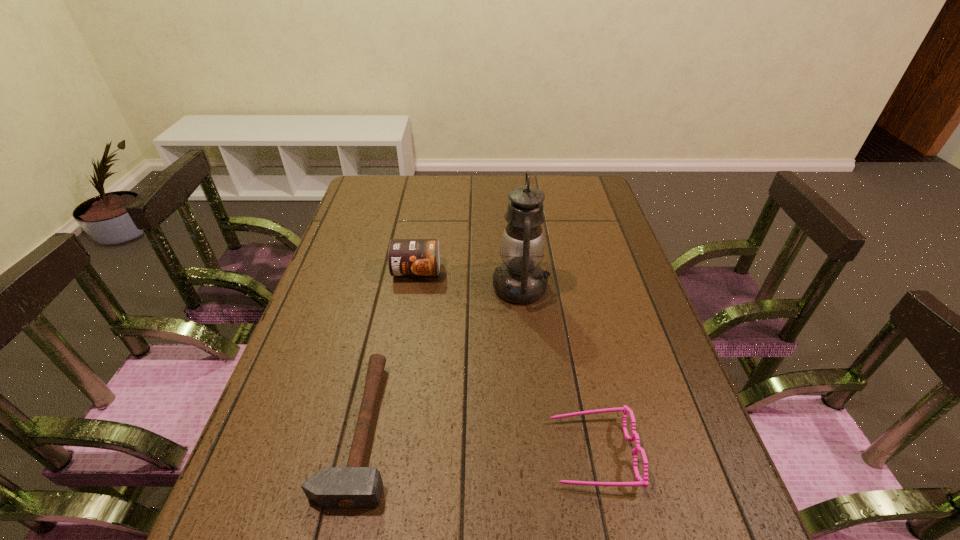
Locate an element on the screen. This screenshot has width=960, height=540. object at the left edge is located at coordinates (352, 487).

What are the coordinates of `object present at the right edge` in the screenshot? It's located at (643, 481).

Where is `free space at the far edge of the desktop`? free space at the far edge of the desktop is located at coordinates (441, 180).

In the image, there is a desktop. Identify the location of free space at the left edge. (356, 212).

This screenshot has height=540, width=960. I want to click on vacant space at the right edge of the desktop, so click(612, 226).

Where is `free spot at the far left corner of the desktop`? Image resolution: width=960 pixels, height=540 pixels. free spot at the far left corner of the desktop is located at coordinates (393, 189).

This screenshot has width=960, height=540. I want to click on vacant space at the far right corner of the desktop, so click(571, 187).

You are a GUI agent. You are given a task and a screenshot of the screen. Output one action in this format:
    pyautogui.click(x=<x>, y=<y>)
    Task: Click on the free space that is in between the third shortest object and the shortest object
    
    Given the screenshot: What is the action you would take?
    pyautogui.click(x=389, y=350)

Where is `free space between the tallest object and the can`? The image size is (960, 540). free space between the tallest object and the can is located at coordinates (468, 279).

Locate an element on the screen. Image resolution: width=960 pixels, height=540 pixels. free space between the third shortest object and the second shortest object is located at coordinates (505, 362).